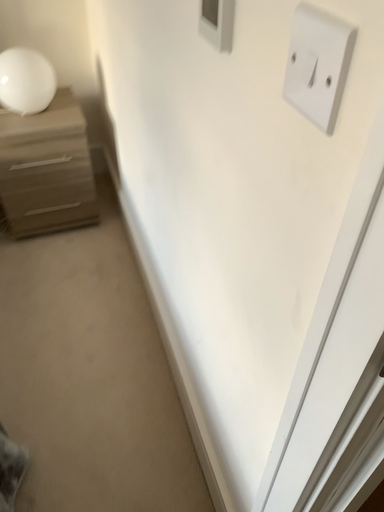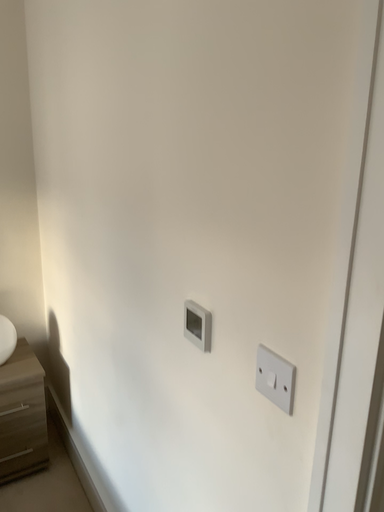
Question: Which way did the camera rotate in the video?

Choices:
 (A) rotated downward
 (B) rotated upward

Answer: (B)